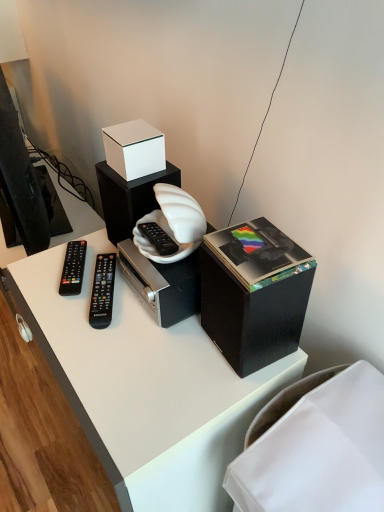
What do you see at coordinates (73, 268) in the screenshot?
I see `black plastic remote at left, marked as the 2th remote control in a right-to-left arrangement` at bounding box center [73, 268].

What is the approximate width of black plastic remote at center, the first remote control from the right?

The width of black plastic remote at center, the first remote control from the right, is 2.03 inches.

The height and width of the screenshot is (512, 384). Find the location of `black plastic remote at center, the first remote control from the right`. black plastic remote at center, the first remote control from the right is located at coordinates (102, 291).

This screenshot has height=512, width=384. Find the location of `black matte file cabinet at upper right`. black matte file cabinet at upper right is located at coordinates (254, 293).

At what (x,y) coordinates should I click in order to perform the action: click on white matte box at upper center. Please return your answer as a coordinate pair (x, y). The width and height of the screenshot is (384, 512). Looking at the image, I should click on (134, 149).

What is the approximate width of white matte speaker at center?

4.49 inches.

Locate an element on the screen. black plastic remote at left, the first remote control viewed from the left is located at coordinates (73, 268).

Is black plastic remote at center, placed as the 2th remote control when sorted from left to right, oriented away from white fabric at lower right?

No, black plastic remote at center, placed as the 2th remote control when sorted from left to right, is not facing away from white fabric at lower right.

Can we say black plastic remote at center, placed as the 2th remote control when sorted from left to right, lies outside white fabric at lower right?

Yes, black plastic remote at center, placed as the 2th remote control when sorted from left to right, is located beyond the bounds of white fabric at lower right.

In the scene shown: Are black plastic remote at center, placed as the 2th remote control when sorted from left to right, and white fabric at lower right located far from each other?

Actually, black plastic remote at center, placed as the 2th remote control when sorted from left to right, and white fabric at lower right are a little close together.

Which of these two, black plastic remote at center, the first remote control from the right, or white fabric at lower right, stands shorter?

Standing shorter between the two is black plastic remote at center, the first remote control from the right.

From a real-world perspective, is black plastic remote at left, marked as the 2th remote control in a right-to-left arrangement, physically located above or below black matte file cabinet at upper right?

black plastic remote at left, marked as the 2th remote control in a right-to-left arrangement, is below black matte file cabinet at upper right.

From their relative heights in the image, would you say black plastic remote at left, the first remote control viewed from the left, is taller or shorter than black matte file cabinet at upper right?

Clearly, black plastic remote at left, the first remote control viewed from the left, is shorter compared to black matte file cabinet at upper right.

Is black plastic remote at left, the first remote control viewed from the left, inside the boundaries of black matte file cabinet at upper right, or outside?

black plastic remote at left, the first remote control viewed from the left, is outside black matte file cabinet at upper right.

In the scene shown: From a real-world perspective, relative to black plastic remote at left, marked as the 2th remote control in a right-to-left arrangement, is black matte file cabinet at upper right vertically above or below?

In terms of real-world spatial position, black matte file cabinet at upper right is above black plastic remote at left, marked as the 2th remote control in a right-to-left arrangement.

Is black matte file cabinet at upper right touching black plastic remote at left, marked as the 2th remote control in a right-to-left arrangement?

No, black matte file cabinet at upper right is not touching black plastic remote at left, marked as the 2th remote control in a right-to-left arrangement.

Looking at this image, how far apart are black matte file cabinet at upper right and black plastic remote at left, marked as the 2th remote control in a right-to-left arrangement?

black matte file cabinet at upper right and black plastic remote at left, marked as the 2th remote control in a right-to-left arrangement, are 16.41 inches apart.

Looking at this image, can you confirm if black matte file cabinet at upper right is shorter than black plastic remote at left, the first remote control viewed from the left?

In fact, black matte file cabinet at upper right may be taller than black plastic remote at left, the first remote control viewed from the left.

Can you confirm if white fabric at lower right is shorter than black plastic remote at center, the first remote control from the right?

Incorrect, the height of white fabric at lower right does not fall short of that of black plastic remote at center, the first remote control from the right.

Is white fabric at lower right aimed at black plastic remote at center, the first remote control from the right?

No, white fabric at lower right is not oriented towards black plastic remote at center, the first remote control from the right.

Which point is more forward, (369,411) or (94,295)?

The point (369,411) is closer.

From a real-world perspective, is white fabric at lower right positioned under black plastic remote at center, the first remote control from the right, based on gravity?

Correct, in the physical world, white fabric at lower right is lower than black plastic remote at center, the first remote control from the right.

In the scene shown: Does black matte file cabinet at upper right lie in front of black plastic remote at center, placed as the 2th remote control when sorted from left to right?

Yes, black matte file cabinet at upper right is closer to the camera.

Does point (259, 319) lie behind point (103, 267)?

No.

From a real-world perspective, between black matte file cabinet at upper right and black plastic remote at center, placed as the 2th remote control when sorted from left to right, who is vertically higher?

In real-world perspective, black matte file cabinet at upper right is above.

Is black matte file cabinet at upper right taller than black plastic remote at center, placed as the 2th remote control when sorted from left to right?

Indeed, black matte file cabinet at upper right has a greater height compared to black plastic remote at center, placed as the 2th remote control when sorted from left to right.

Is black plastic remote at left, marked as the 2th remote control in a right-to-left arrangement, inside or outside of white fabric at lower right?

black plastic remote at left, marked as the 2th remote control in a right-to-left arrangement, is spatially situated outside white fabric at lower right.

Consider the image. Between black plastic remote at left, marked as the 2th remote control in a right-to-left arrangement, and white fabric at lower right, which one has smaller size?

With smaller size is black plastic remote at left, marked as the 2th remote control in a right-to-left arrangement.

From a real-world perspective, which object rests below the other?

white fabric at lower right.

Is point (82, 269) farther from camera compared to point (356, 431)?

Yes, point (82, 269) is farther from viewer.

Is black matte file cabinet at upper right inside black plastic remote at center, placed as the 2th remote control when sorted from left to right?

No.

Consider the image. How many degrees apart are the facing directions of black plastic remote at center, placed as the 2th remote control when sorted from left to right, and black matte file cabinet at upper right?

The angle between the facing direction of black plastic remote at center, placed as the 2th remote control when sorted from left to right, and the facing direction of black matte file cabinet at upper right is 26 degrees.

Can you confirm if black plastic remote at center, the first remote control from the right, is shorter than black matte file cabinet at upper right?

Yes, black plastic remote at center, the first remote control from the right, is shorter than black matte file cabinet at upper right.

From a real-world perspective, relative to black matte file cabinet at upper right, is black plastic remote at center, the first remote control from the right, vertically above or below?

black plastic remote at center, the first remote control from the right, is below black matte file cabinet at upper right.

Identify the location of furniture lying below the black plastic remote at center, the first remote control from the right (from the image's perspective). (315, 447).

The image size is (384, 512). Identify the location of file cabinet that appears above the black plastic remote at left, marked as the 2th remote control in a right-to-left arrangement (from a real-world perspective). (254, 293).

From the image, which object appears to be nearer to white matte speaker at center, white matte box at upper center or black matte file cabinet at upper right?

white matte box at upper center lies closer to white matte speaker at center than the other object.

Estimate the real-world distances between objects in this image. Which object is closer to black plastic remote at center, placed as the 2th remote control when sorted from left to right, black matte file cabinet at upper right or white matte speaker at center?

Based on the image, white matte speaker at center appears to be nearer to black plastic remote at center, placed as the 2th remote control when sorted from left to right.

From the image, which object appears to be nearer to black matte file cabinet at upper right, black plastic remote at center, the first remote control from the right, or white matte speaker at center?

white matte speaker at center.

Estimate the real-world distances between objects in this image. Which object is closer to white fabric at lower right, white matte box at upper center or black plastic remote at center, the first remote control from the right?

Among the two, black plastic remote at center, the first remote control from the right, is located nearer to white fabric at lower right.

From the image, which object appears to be nearer to white fabric at lower right, black plastic remote at center, placed as the 2th remote control when sorted from left to right, or black plastic remote at left, the first remote control viewed from the left?

black plastic remote at center, placed as the 2th remote control when sorted from left to right.

Estimate the real-world distances between objects in this image. Which object is further from black plastic remote at left, marked as the 2th remote control in a right-to-left arrangement, white matte box at upper center or black matte file cabinet at upper right?

Among the two, black matte file cabinet at upper right is located further to black plastic remote at left, marked as the 2th remote control in a right-to-left arrangement.

From the image, which object appears to be farther from black matte file cabinet at upper right, white matte speaker at center or black plastic remote at left, marked as the 2th remote control in a right-to-left arrangement?

Based on the image, black plastic remote at left, marked as the 2th remote control in a right-to-left arrangement, appears to be further to black matte file cabinet at upper right.

When comparing their distances from white matte speaker at center, does black plastic remote at left, marked as the 2th remote control in a right-to-left arrangement, or white matte box at upper center seem closer?

Among the two, white matte box at upper center is located nearer to white matte speaker at center.

Identify the location of speaker between white matte box at upper center and white fabric at lower right vertically. click(x=129, y=198).

Where is `speaker located between black plastic remote at left, the first remote control viewed from the left, and black matte file cabinet at upper right in the left-right direction`? speaker located between black plastic remote at left, the first remote control viewed from the left, and black matte file cabinet at upper right in the left-right direction is located at coordinates (129, 198).

The width and height of the screenshot is (384, 512). I want to click on box between black plastic remote at left, marked as the 2th remote control in a right-to-left arrangement, and black matte file cabinet at upper right, so (134, 149).

Find the location of a particular element. speaker between white matte box at upper center and black plastic remote at center, the first remote control from the right, from top to bottom is located at coordinates (129, 198).